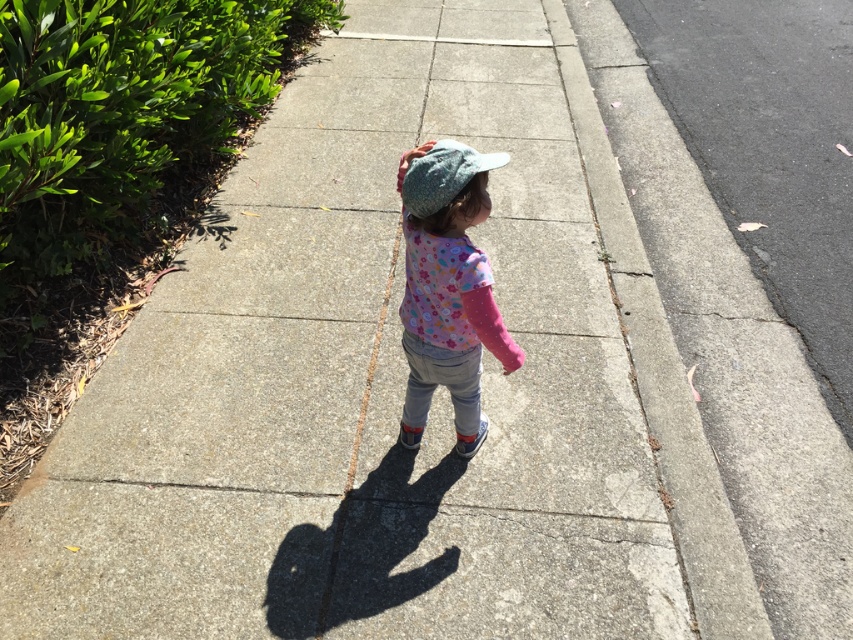
Can you confirm if fluffy cotton hat at center is positioned below knitted blue cap at center?

Yes.

Measure the distance between point (407, 348) and camera.

The distance of point (407, 348) from camera is 2.49 meters.

Is point (450, 256) positioned before point (463, 176)?

No, (450, 256) is further to viewer.

I want to click on fluffy cotton hat at center, so click(x=447, y=289).

Does gray concrete curb at right appear on the left side of fluffy cotton hat at center?

No, gray concrete curb at right is not to the left of fluffy cotton hat at center.

Can you confirm if gray concrete curb at right is smaller than fluffy cotton hat at center?

Actually, gray concrete curb at right might be larger than fluffy cotton hat at center.

The image size is (853, 640). What are the coordinates of `gray concrete curb at right` in the screenshot? It's located at (660, 380).

Is gray concrete curb at right positioned before knitted blue cap at center?

No, gray concrete curb at right is behind knitted blue cap at center.

Which is in front, point (675, 456) or point (444, 193)?

Point (444, 193) is more forward.

Who is more forward, [691,588] or [486,154]?

Result: Point [486,154] is in front.

At what (x,y) coordinates should I click in order to perform the action: click on gray concrete curb at right. Please return your answer as a coordinate pair (x, y). Looking at the image, I should click on (660, 380).